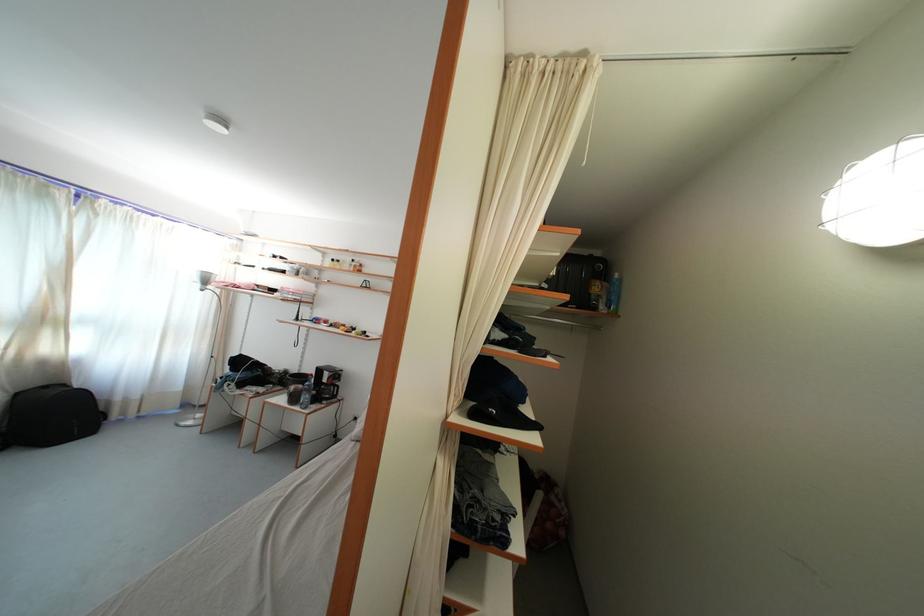
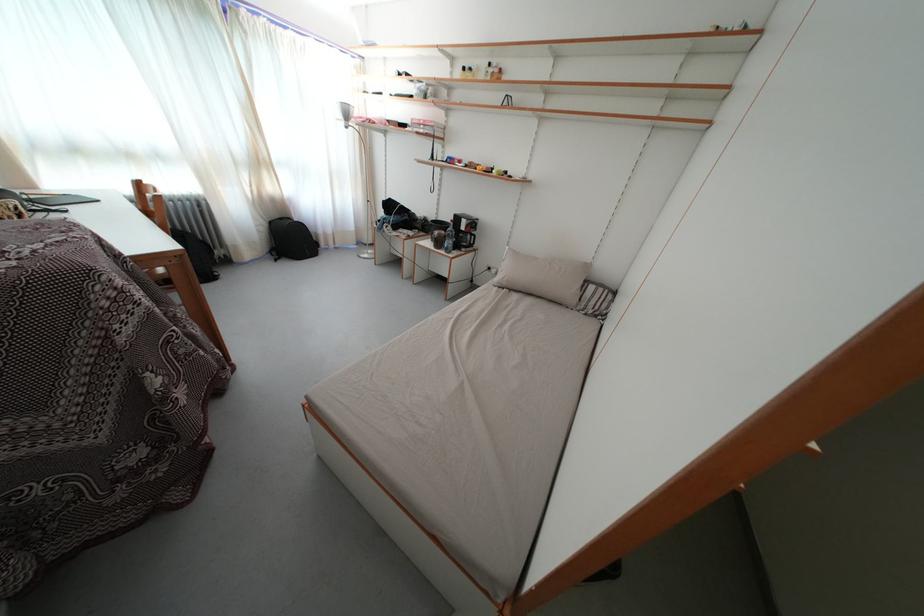
Based on the continuous images, in which direction is the camera rotating?

The rotation direction of the camera is left-down.